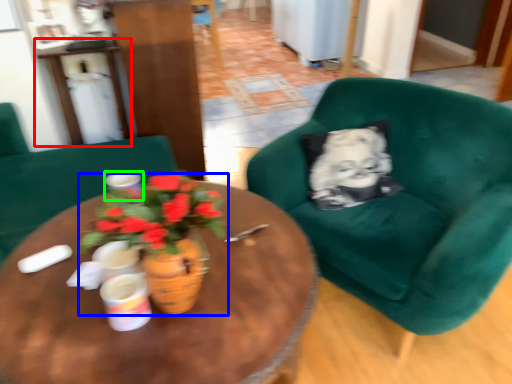
Question: Which is farther away from table (highlighted by a red box)? houseplant (highlighted by a blue box) or coffee cup (highlighted by a green box)?

Choices:
 (A) houseplant
 (B) coffee cup

Answer: (A)